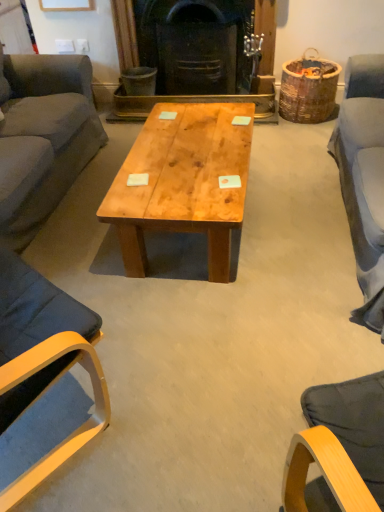
The image size is (384, 512). I want to click on free location in front of natural wood coffee table at center, so click(x=224, y=328).